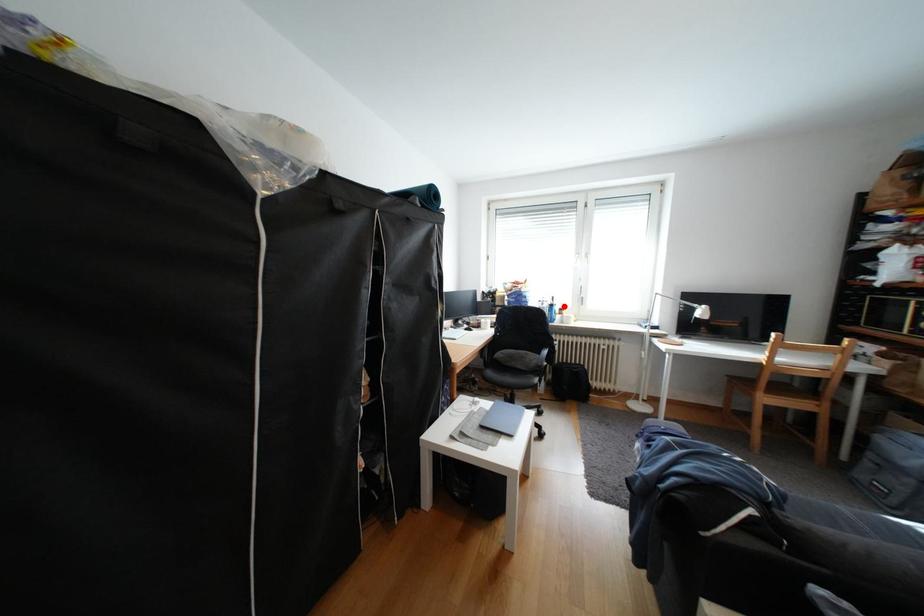
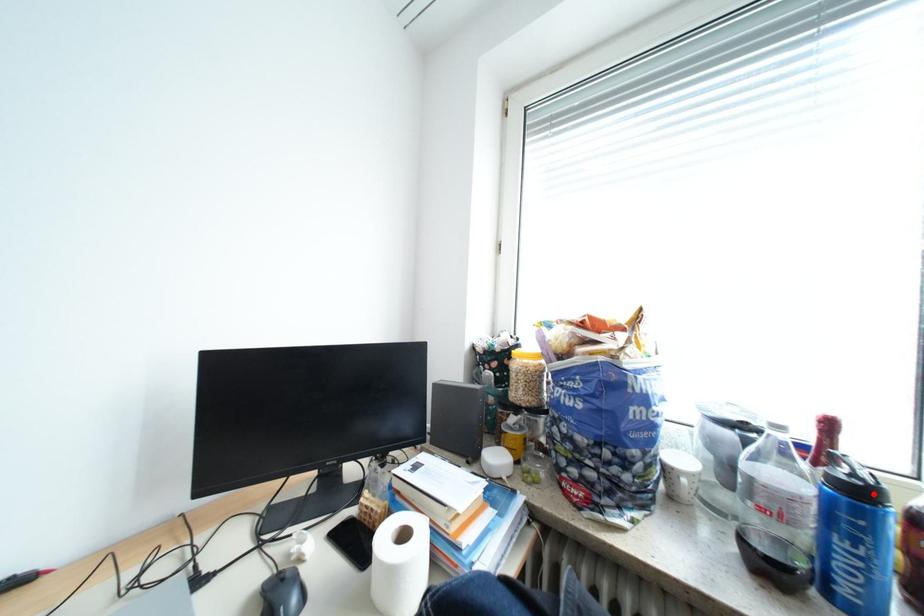
I am providing you with two images of the same scene from different viewpoints. A red point is marked on the first image and another point is marked on the second image. Is the red point in image1 aligned with the point shown in image2?

Yes